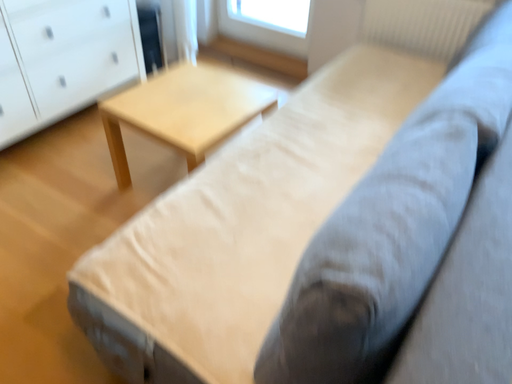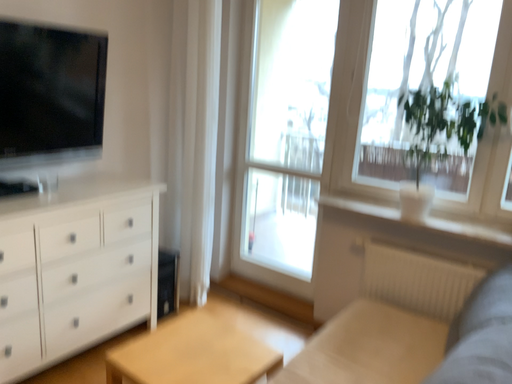
Question: How did the camera likely rotate when shooting the video?

Choices:
 (A) rotated upward
 (B) rotated downward

Answer: (A)